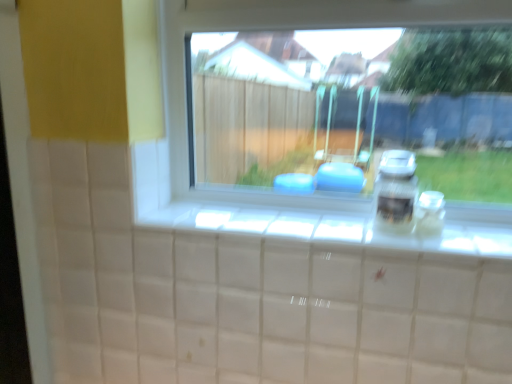
Where is `free point in front of satin silver jar at right`? This screenshot has height=384, width=512. free point in front of satin silver jar at right is located at coordinates (420, 247).